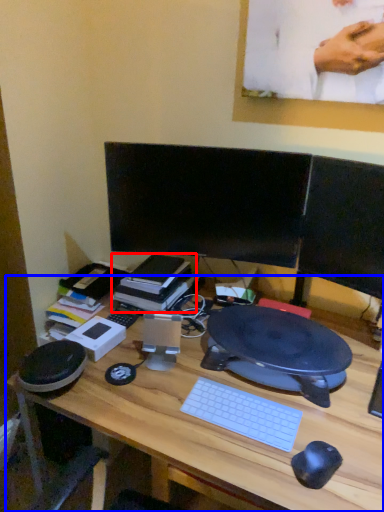
Question: Which object appears closest to the camera in this image, book (highlighted by a red box) or desk (highlighted by a blue box)?

Choices:
 (A) book
 (B) desk

Answer: (B)